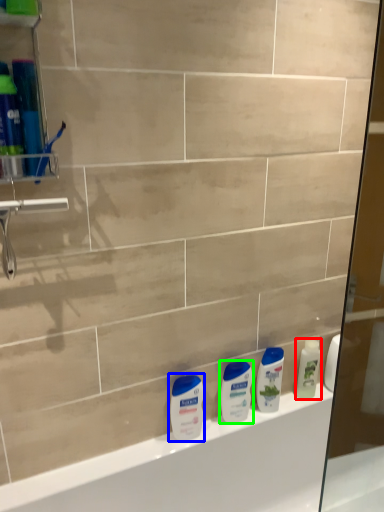
Question: Which is farther away from cleaning product (highlighted by a red box)? toiletry (highlighted by a blue box) or toiletry (highlighted by a green box)?

Choices:
 (A) toiletry
 (B) toiletry

Answer: (A)